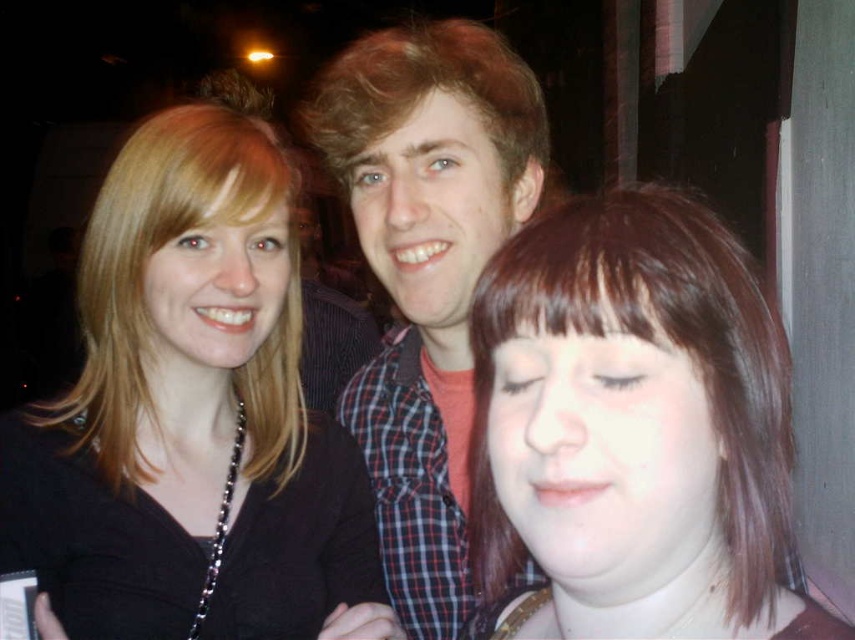
Question: Which point is farther to the camera?

Choices:
 (A) (782, 536)
 (B) (332, 104)

Answer: (B)

Question: Can you confirm if plaid shirt at center is positioned to the right of blondehair at center?

Choices:
 (A) yes
 (B) no

Answer: (A)

Question: Which point is farther to the camera?

Choices:
 (A) plaid shirt at center
 (B) brown hair at center
 (C) blondehair at center
 (D) matte black shirt at left

Answer: (C)

Question: Does brown hair at center have a greater width compared to plaid shirt at center?

Choices:
 (A) yes
 (B) no

Answer: (A)

Question: Which is nearer to the blondehair at center?

Choices:
 (A) brown hair at center
 (B) matte black shirt at left

Answer: (B)

Question: Where is plaid shirt at center located in relation to blondehair at center in the image?

Choices:
 (A) above
 (B) below

Answer: (B)